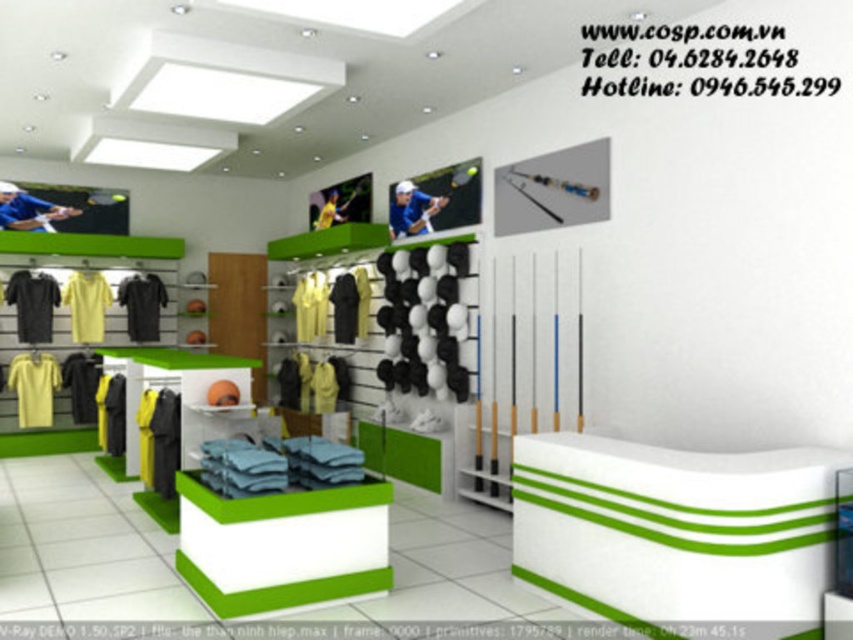
Can you confirm if dark gray fabric jacket at center is positioned below yellow fabric at center?

Yes.

Identify the location of dark gray fabric jacket at center. Image resolution: width=853 pixels, height=640 pixels. (111, 413).

Locate an element on the screen. dark gray fabric jacket at center is located at coordinates (111, 413).

Measure the distance from matte yellow t-shirt at left to matte blue shirt at center.

matte yellow t-shirt at left is 1.08 meters from matte blue shirt at center.

Find the location of a particular element. matte yellow t-shirt at left is located at coordinates (86, 305).

Does blue fabric shirt at center have a lesser height compared to matte blue shirt at center?

No, blue fabric shirt at center is not shorter than matte blue shirt at center.

Locate an element on the screen. blue fabric shirt at center is located at coordinates (409, 212).

Describe the element at coordinates (409, 212) in the screenshot. The height and width of the screenshot is (640, 853). I see `blue fabric shirt at center` at that location.

Where is `blue fabric shirt at center`? The height and width of the screenshot is (640, 853). blue fabric shirt at center is located at coordinates (409, 212).